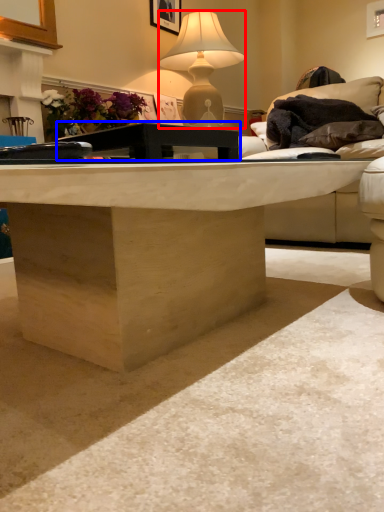
Question: Which object appears farthest to the camera in this image, lamp (highlighted by a red box) or table (highlighted by a blue box)?

Choices:
 (A) lamp
 (B) table

Answer: (A)